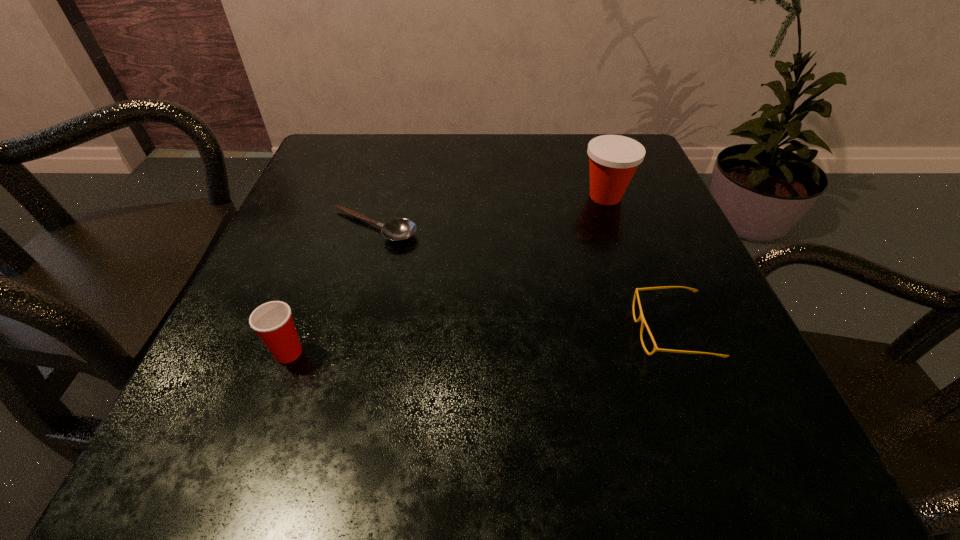
The width and height of the screenshot is (960, 540). Find the location of `vacant region at the left edge of the desktop`. vacant region at the left edge of the desktop is located at coordinates (327, 213).

Identify the location of free space at the right edge of the desktop. (683, 262).

Identify the location of vacant area at the far left corner of the desktop. This screenshot has height=540, width=960. (377, 157).

The width and height of the screenshot is (960, 540). Identify the location of free space between the nearer Dixie cup and the spectacles. (480, 342).

Locate an element on the screen. This screenshot has width=960, height=540. free space between the tallest object and the ladle is located at coordinates (490, 212).

You are a GUI agent. You are given a task and a screenshot of the screen. Output one action in this format:
    pyautogui.click(x=<x>, y=<y>)
    Task: Click on the vacant area that lies between the spectacles and the ladle
    This screenshot has height=540, width=960.
    Given the screenshot: What is the action you would take?
    pyautogui.click(x=522, y=280)

I want to click on free space that is in between the third tallest object and the ladle, so click(x=522, y=280).

This screenshot has height=540, width=960. I want to click on free space between the ladle and the right Dixie cup, so click(490, 212).

Find the location of a particular element. vacant space in between the nearer Dixie cup and the spectacles is located at coordinates (480, 342).

In order to click on free space between the taller Dixie cup and the spectacles in this screenshot , I will do `click(638, 264)`.